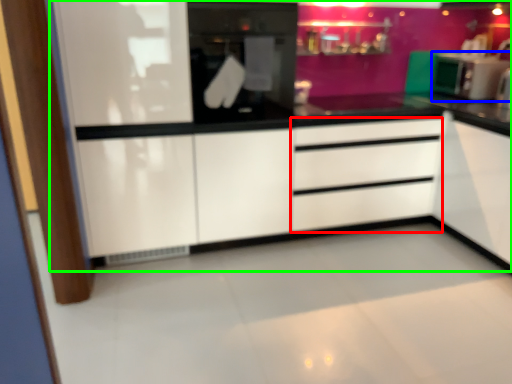
Question: Considering the real-world distances, which object is closest to drawer (highlighted by a red box)? kitchen appliance (highlighted by a blue box) or dresser (highlighted by a green box).

Choices:
 (A) kitchen appliance
 (B) dresser

Answer: (B)